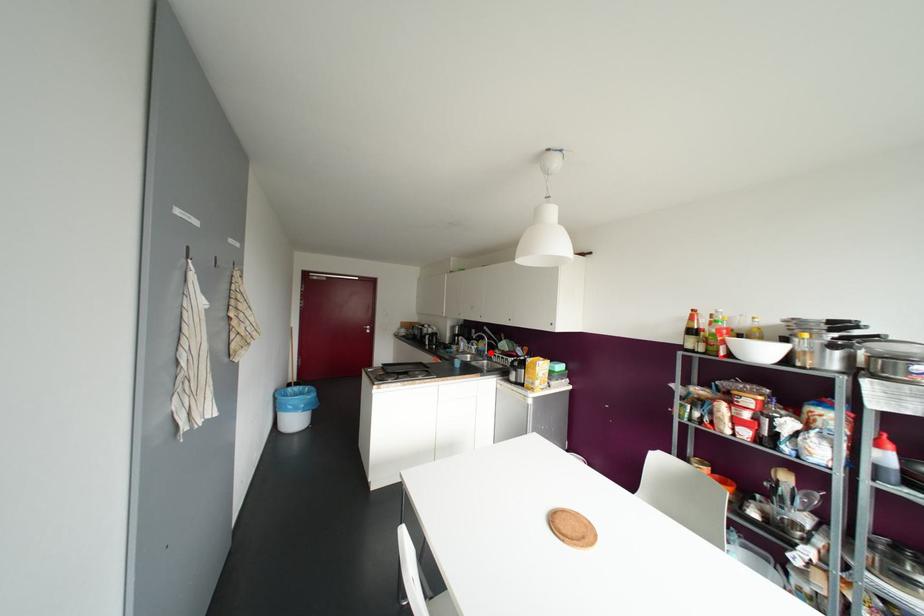
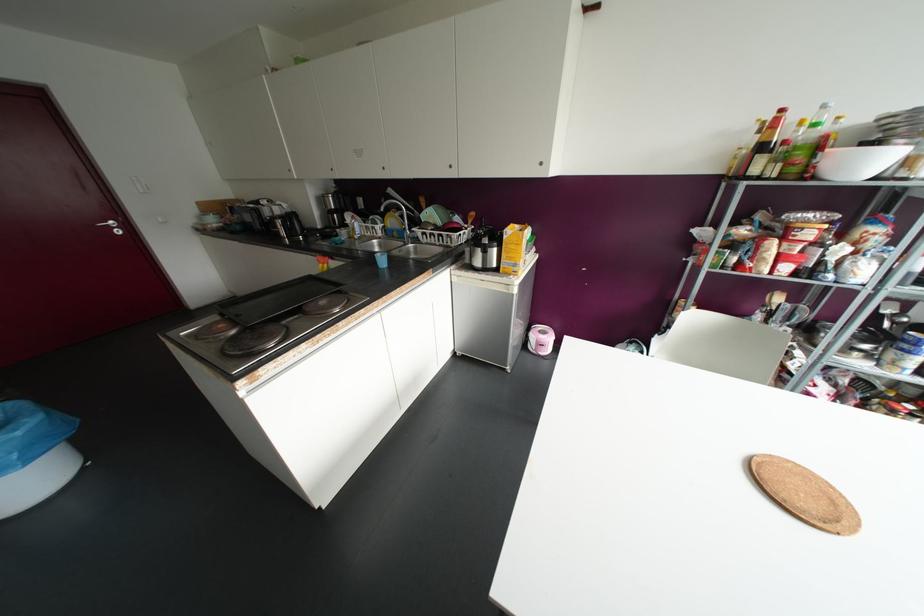
Question: I am providing you with two images of the same scene from different viewpoints. In image1, a red point is highlighted. Considering the same 3D point in image2, which of the following is correct?

Choices:
 (A) It is closer
 (B) It is farther

Answer: (A)